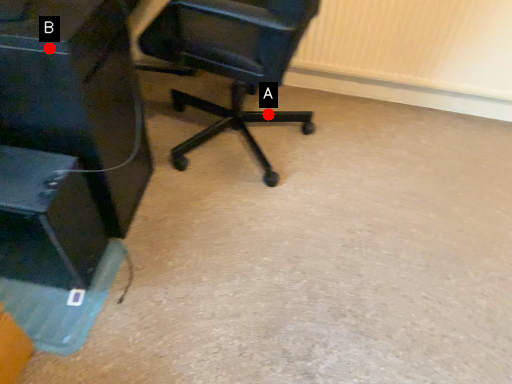
Question: Two points are circled on the image, labeled by A and B beside each circle. Which point appears farthest from the camera in this image?

Choices:
 (A) A is further
 (B) B is further

Answer: (A)